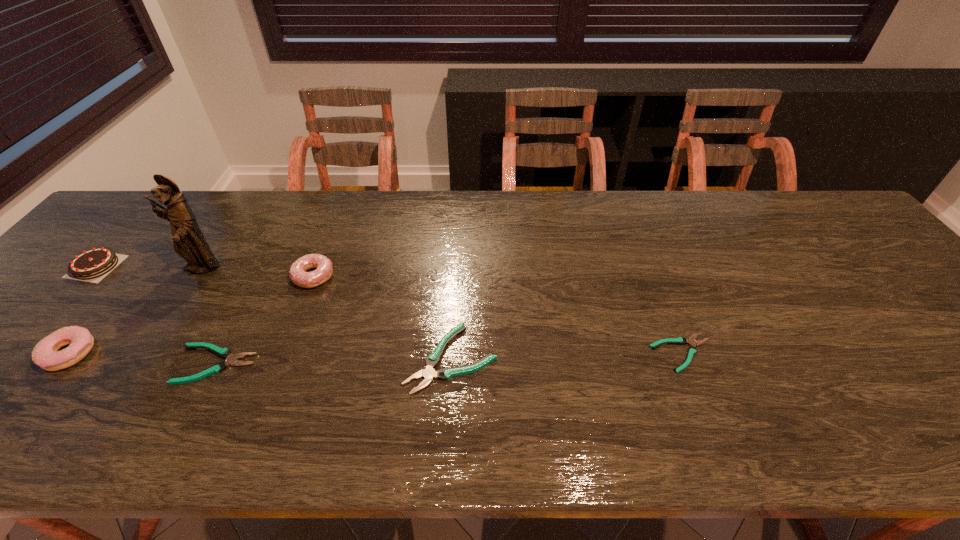
Observe the arrangement of all plierss in the image. To keep them evenly spaced, where would you place another pliers on the right? Please locate a free space. Please provide its 2D coordinates. Your answer should be formatted as a tuple, i.e. [(x, y)], where the tuple contains the x and y coordinates of a point satisfying the conditions above.

[(907, 348)]